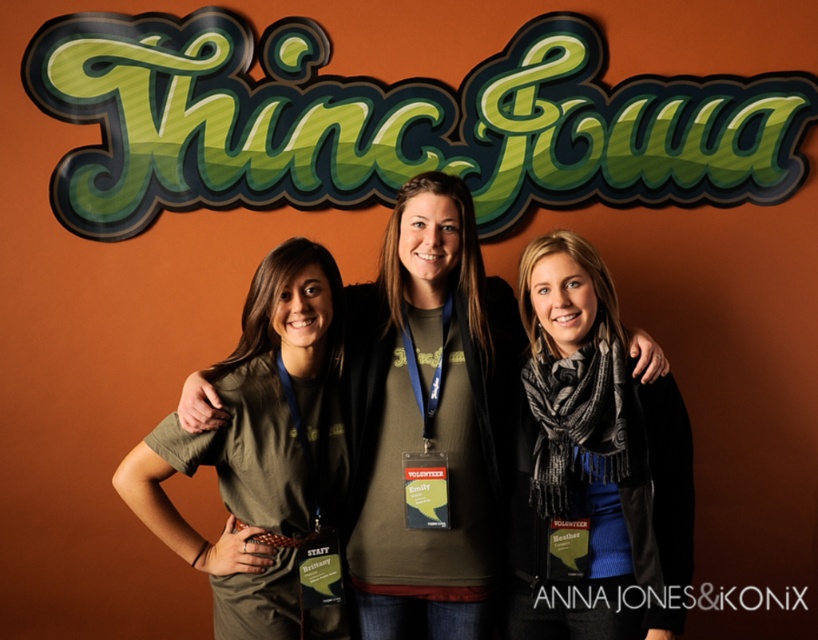
In the scene shown: In the scene with three people in front of an orange wall with a green and black sign, there is a black textured scarf at center and a matte olive green shirt at center. Which object is located to the right of the other?

The black textured scarf at center is positioned on the right side of the matte olive green shirt at center.